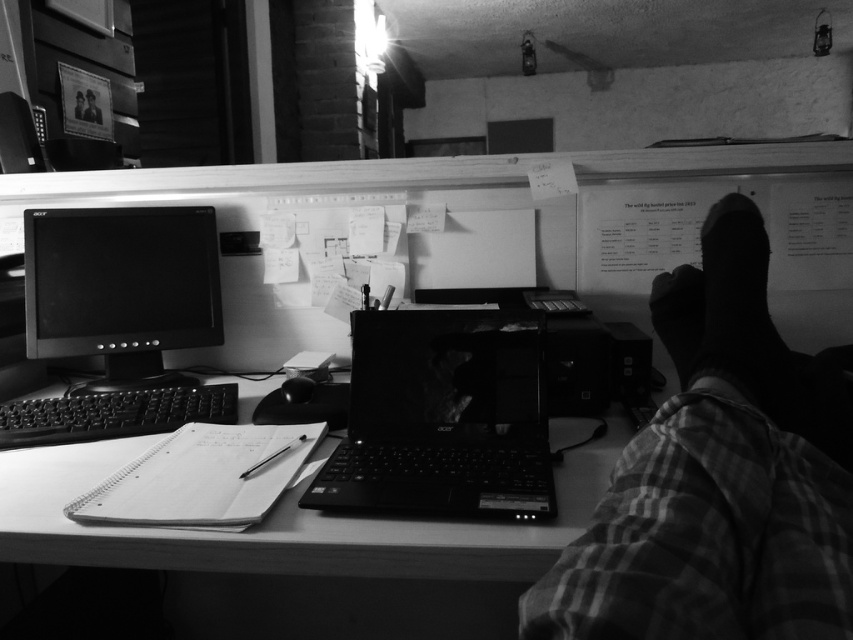
Question: Which of the following is the closest to the observer?

Choices:
 (A) (700, 232)
 (B) (541, 344)

Answer: (B)

Question: Which point is closer to the camera taking this photo?

Choices:
 (A) pos(421,452)
 (B) pos(426,276)
 (C) pos(142,356)

Answer: (A)

Question: Which object is closer to the camera taking this photo?

Choices:
 (A) matte black monitor at left
 (B) smooth plastic computer desk at center

Answer: (B)

Question: Is plaid fabric leg at right above smooth skin foot at lower right?

Choices:
 (A) yes
 (B) no

Answer: (B)

Question: Is matte black monitor at left thinner than black smooth sock at upper right?

Choices:
 (A) yes
 (B) no

Answer: (B)

Question: Is smooth plastic computer desk at center smaller than black plastic keyboard at lower left?

Choices:
 (A) no
 (B) yes

Answer: (A)